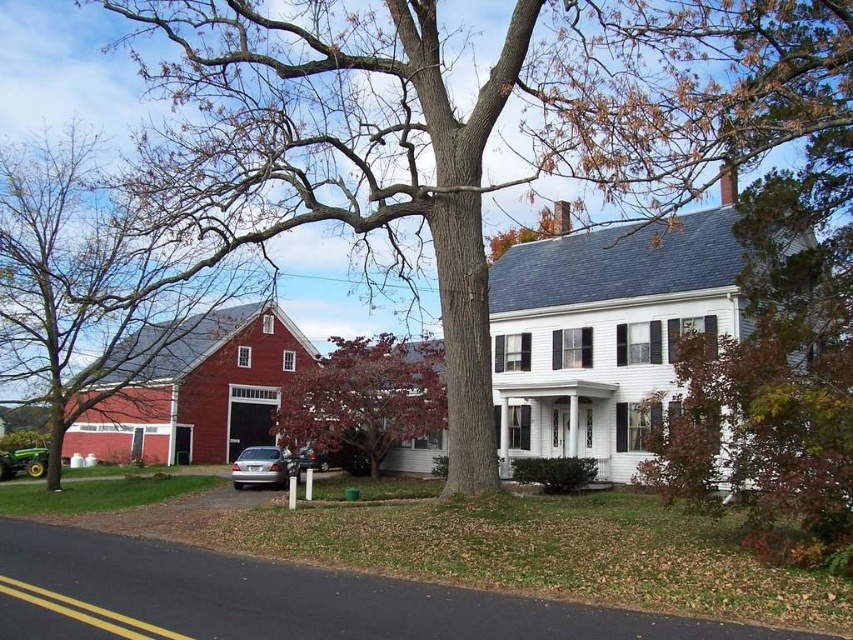
Can you confirm if bare wood tree at center is positioned to the left of reddish-brown bark tree at center?

Incorrect, bare wood tree at center is not on the left side of reddish-brown bark tree at center.

Find the location of `bare wood tree at center`. bare wood tree at center is located at coordinates (482, 129).

Where is `bare wood tree at center`? Image resolution: width=853 pixels, height=640 pixels. bare wood tree at center is located at coordinates [482, 129].

Between smooth red barn at left and metallic silver sedan at center, which one appears on the left side from the viewer's perspective?

Positioned to the left is smooth red barn at left.

How much distance is there between smooth red barn at left and metallic silver sedan at center?

A distance of 10.66 meters exists between smooth red barn at left and metallic silver sedan at center.

Who is more forward, [285,352] or [299,451]?

Point [299,451]

I want to click on smooth red barn at left, so click(x=196, y=390).

Which is more to the right, white wood house at upper right or bare branches at left?

From the viewer's perspective, white wood house at upper right appears more on the right side.

Between point (529, 301) and point (173, 310), which one is positioned in front?

Point (173, 310) is in front.

Image resolution: width=853 pixels, height=640 pixels. Describe the element at coordinates (604, 330) in the screenshot. I see `white wood house at upper right` at that location.

The width and height of the screenshot is (853, 640). I want to click on white wood house at upper right, so click(604, 330).